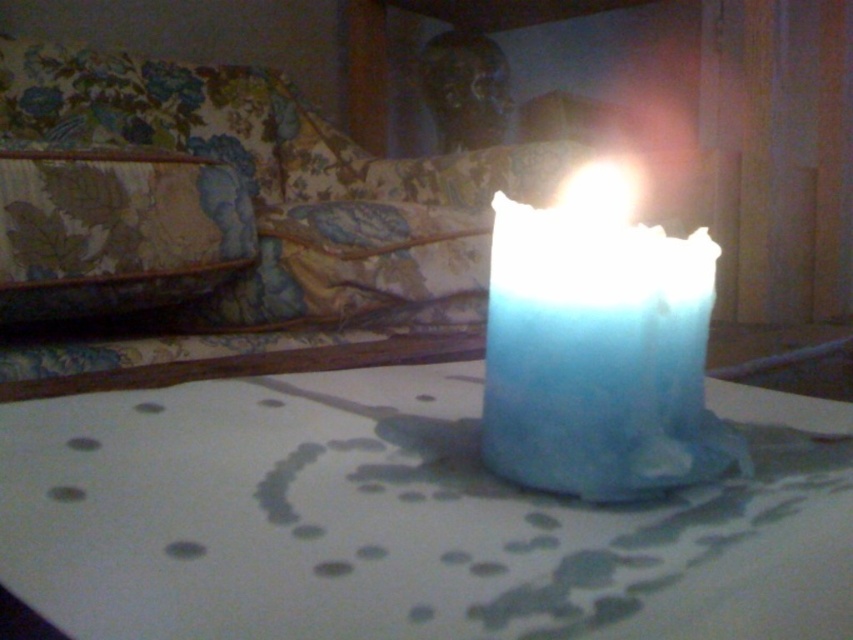
Can you confirm if translucent glass candle at center is taller than blue wax candle at center?

No, translucent glass candle at center is not taller than blue wax candle at center.

Who is more forward, (724, 557) or (561, 218)?

Point (724, 557) is in front.

This screenshot has height=640, width=853. Identify the location of translucent glass candle at center. (403, 518).